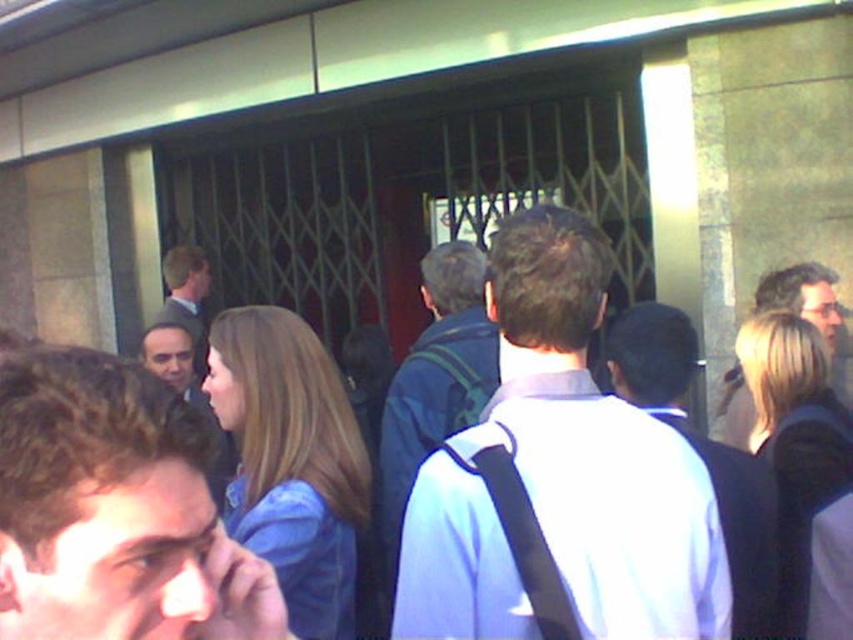
Between point (48, 396) and point (811, 317), which one is positioned in front?

Point (48, 396) is more forward.

Can you confirm if blue fabric jacket at center is smaller than light brown hair at center?

Yes.

Locate an element on the screen. blue fabric jacket at center is located at coordinates (114, 509).

Between blue fabric jacket at center and matte black jacket at center, which one is positioned higher?

Positioned higher is matte black jacket at center.

Is blue fabric jacket at center shorter than matte black jacket at center?

Indeed, blue fabric jacket at center has a lesser height compared to matte black jacket at center.

I want to click on blue fabric jacket at center, so click(114, 509).

I want to click on blue fabric jacket at center, so click(114, 509).

Based on the photo, is the position of blue fabric jacket at center more distant than that of smooth skin face at center?

No, blue fabric jacket at center is closer to the viewer.

Is blue fabric jacket at center bigger than smooth skin face at center?

Actually, blue fabric jacket at center might be smaller than smooth skin face at center.

Does point (32, 451) come closer to viewer compared to point (158, 340)?

Yes.

Locate an element on the screen. This screenshot has height=640, width=853. blue fabric jacket at center is located at coordinates (114, 509).